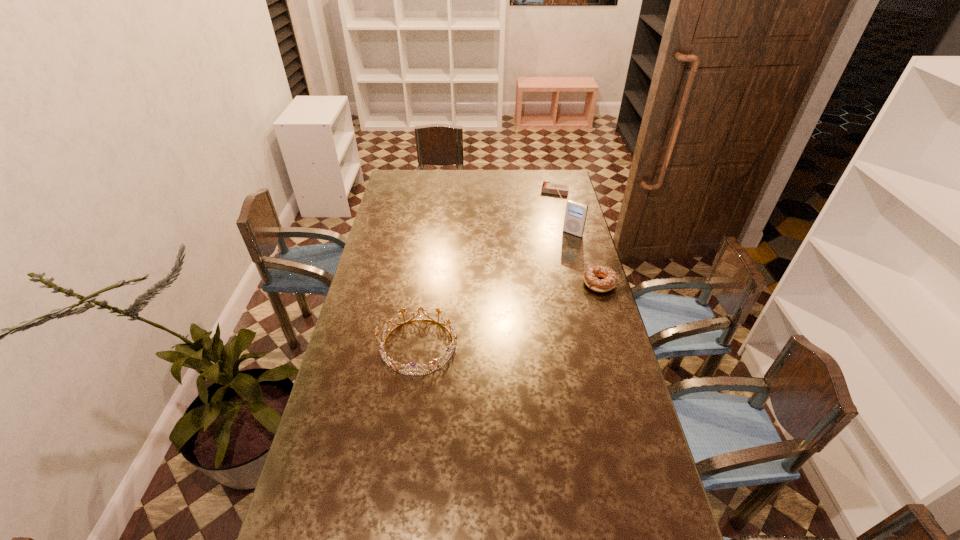
The height and width of the screenshot is (540, 960). What are the coordinates of `free space that satisfies the following two spatial constraints: 1. on the front side of the iPod; 2. on the left side of the doughnut` in the screenshot? It's located at (586, 284).